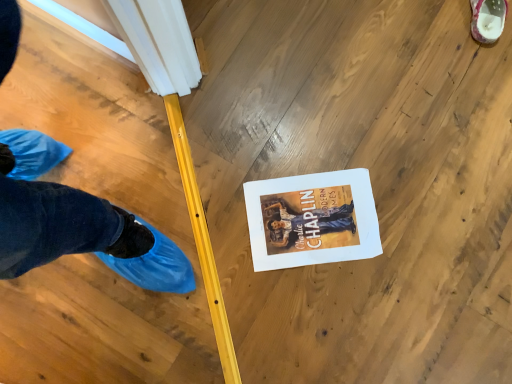
I want to click on vacant space that is to the left of white paper at center, so click(210, 218).